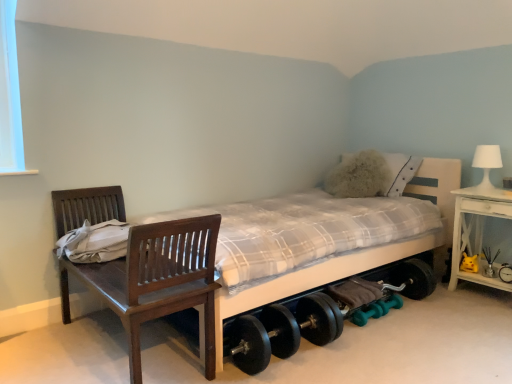
Identify the location of vacant area that lies to the right of green rubber dumbbell at lower center, the 2th dumbbell in the left-to-right sequence. The width and height of the screenshot is (512, 384). (417, 314).